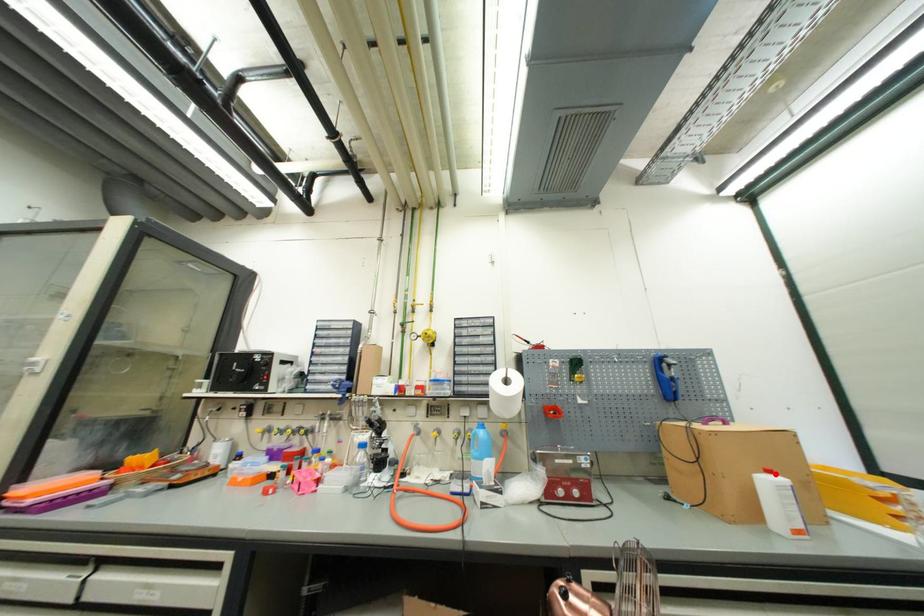
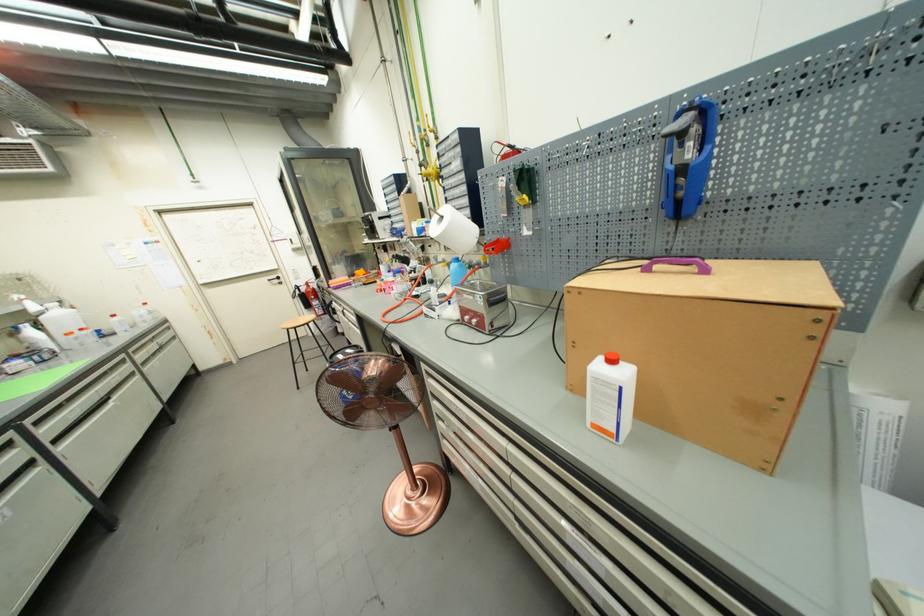
Locate, in the second image, the point that corresponds to the highlighted location in the first image.

(617, 363)